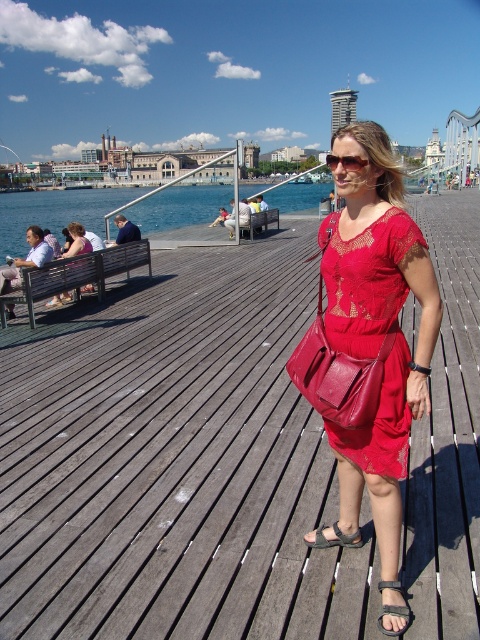
Does point (123, 589) come in front of point (386, 300)?

Yes, it is.

Does wooden planks at center come behind red lace dress at center?

That is False.

Which is in front, point (48, 404) or point (343, 298)?

Point (343, 298) is more forward.

Locate an element on the screen. wooden planks at center is located at coordinates (175, 461).

Between red leather dress at center and matte black dress at center, which one appears on the right side from the viewer's perspective?

Positioned to the right is red leather dress at center.

Who is more forward, (436, 296) or (76, 230)?

Point (436, 296)

Identify the location of red leather dress at center. Image resolution: width=480 pixels, height=640 pixels. (376, 326).

Measure the distance between brown leather sandal at lower center and camera.

13.55 meters

Is brown leather sandal at lower center shorter than black leather sandal at lower center?

In fact, brown leather sandal at lower center may be taller than black leather sandal at lower center.

Does point (382, 627) come farther from viewer compared to point (321, 541)?

That is False.

Find the location of a particular element. The height and width of the screenshot is (640, 480). brown leather sandal at lower center is located at coordinates (395, 614).